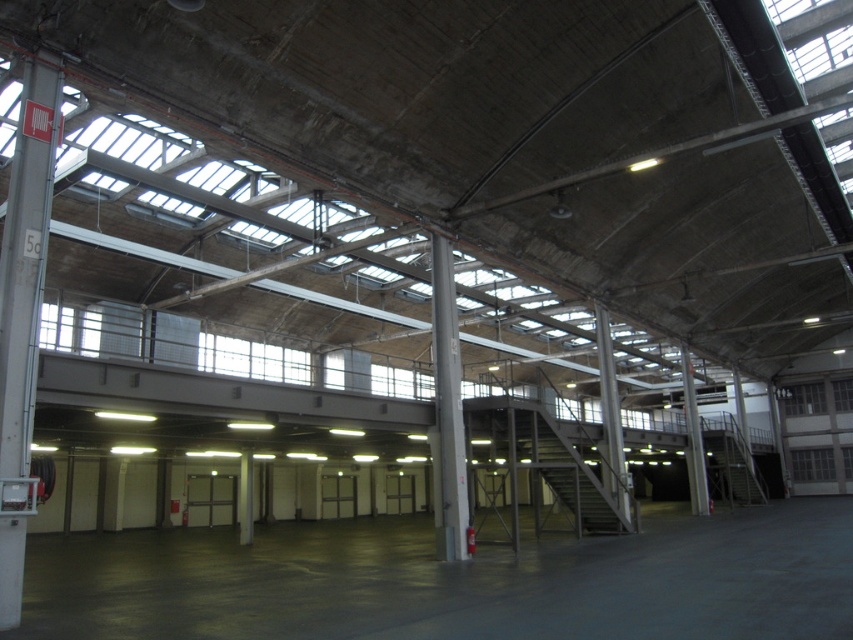
You are an inspector checking the structural integrity of the pillars in the warehouse. You notice two pillars at the center of the warehouse. Which pillar is closer to you, the metallic gray pillar at center or the gray concrete pillar at center?

The metallic gray pillar at center is closer to you because the gray concrete pillar at center is positioned behind it.